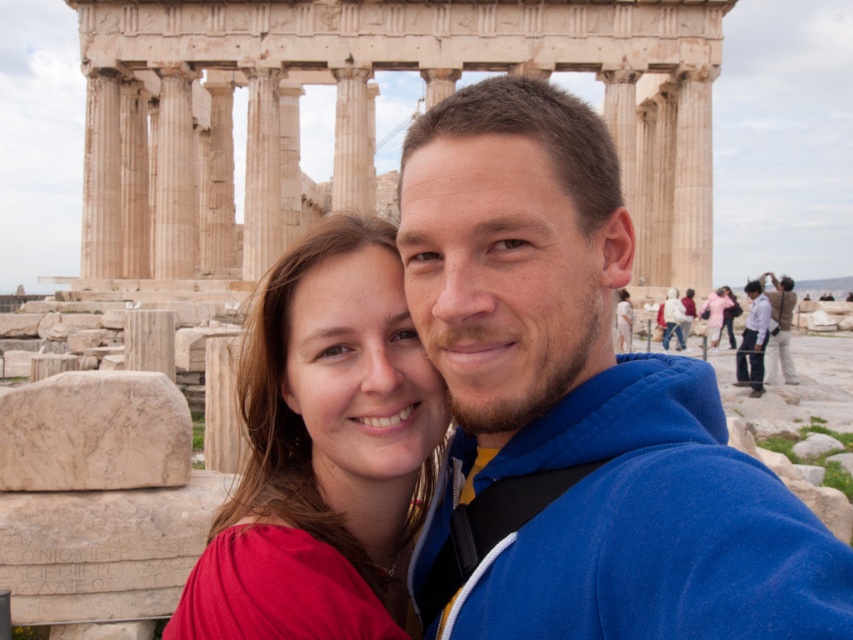
You are a photographer trying to capture a group photo of the light blue shirt at center and the light brown leather jacket at right. If you want to ensure both subjects are in focus, which subject should you adjust your camera focus on first based on their sizes?

The light blue shirt at center has a smaller width than the light brown leather jacket at right, so you should focus on the light brown leather jacket at right first to ensure proper focus since it is larger and might require more precise adjustment.

You are a photographer taking a picture of the two people in front of the Parthenon. You notice the blue fleece jacket at center and the light blue shirt at center. Which clothing item is positioned lower on the person?

The blue fleece jacket at center is below light blue shirt at center, so the blue fleece jacket at center is positioned lower on the person.